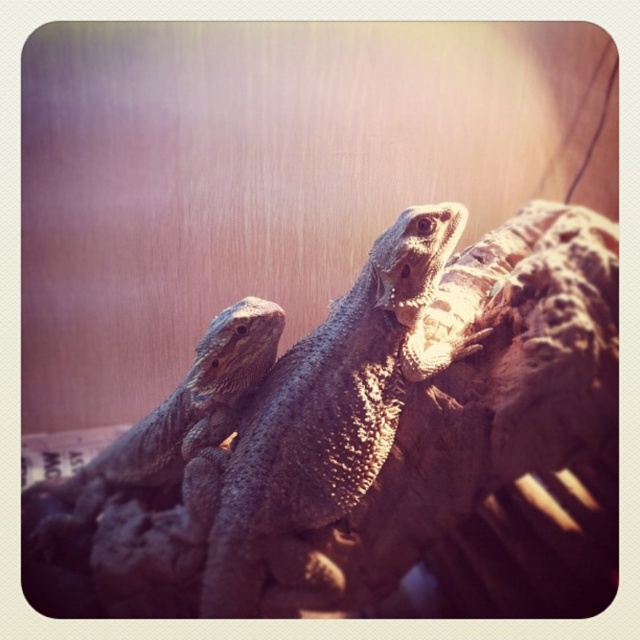
You are a researcher studying the spatial distribution of lizards in their habitat. You observe two bearded dragons in the image. One is a sandy brown scaly lizard at center. The other is at point coordinates of [332,406]. Which lizard is closer to the center of the image?

The sandy brown scaly lizard at center is exactly at the center of the image, so it is closer to the center than the other lizard located at point coordinates of [332,406].

You are a researcher observing two bearded dragons in an enclosure. You notice two specific points marked on the image. One is at point (212,572) and the other at point (211,362). From your vantage point, which point is nearer to you?

Result: Point (212,572) is closer to the viewer than point (211,362).